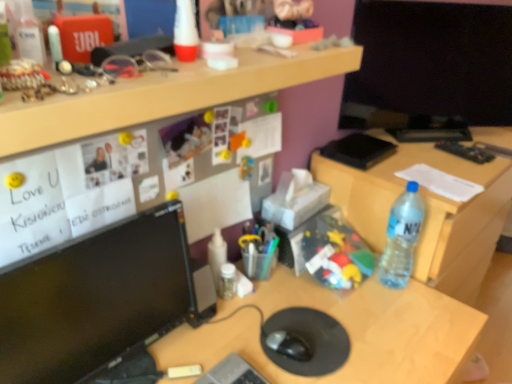
In order to click on vacant space behind black matte mouse at center in this screenshot , I will do point(290,301).